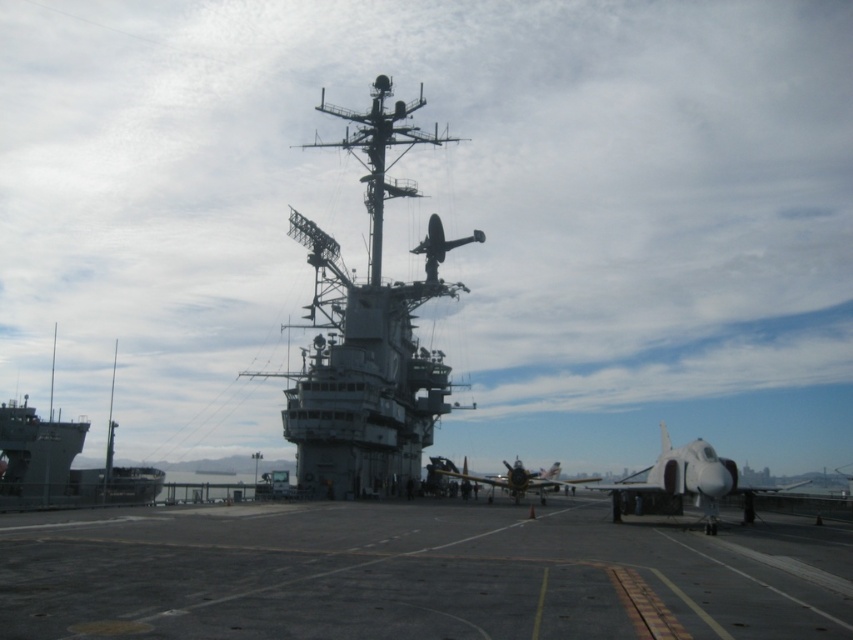
Between white glossy jet at center and yellow matte airplane at center, which one appears on the right side from the viewer's perspective?

Positioned to the right is white glossy jet at center.

Locate an element on the screen. The width and height of the screenshot is (853, 640). white glossy jet at center is located at coordinates (683, 483).

This screenshot has width=853, height=640. I want to click on white glossy jet at center, so click(683, 483).

You are a GUI agent. You are given a task and a screenshot of the screen. Output one action in this format:
    pyautogui.click(x=<x>, y=<y>)
    Task: Click on the gray metallic ship at left
    
    Given the screenshot: What is the action you would take?
    pyautogui.click(x=62, y=465)

Is gray metallic ship at center shorter than white glossy jet at center?

In fact, gray metallic ship at center may be taller than white glossy jet at center.

The image size is (853, 640). Describe the element at coordinates (367, 336) in the screenshot. I see `gray metallic ship at center` at that location.

At what (x,y) coordinates should I click in order to perform the action: click on gray metallic ship at center. Please return your answer as a coordinate pair (x, y). This screenshot has height=640, width=853. Looking at the image, I should click on (367, 336).